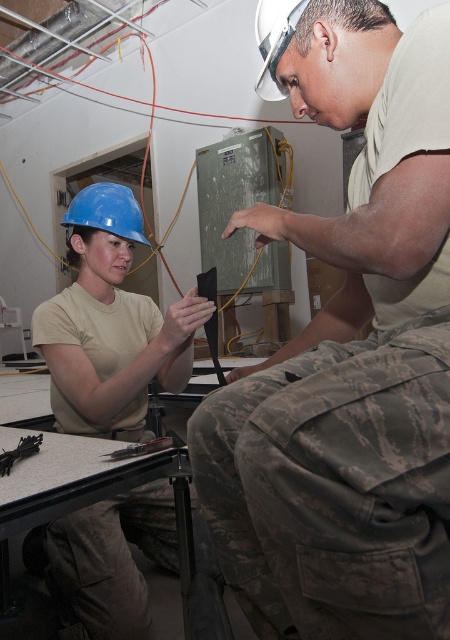
Question: Which is nearer to the metallic silver screwdriver at center?

Choices:
 (A) camouflage fabric pants at lower center
 (B) metallic silver tool at lower left
 (C) blue matte helmet at upper left

Answer: (B)

Question: Does camouflage fabric pants at lower center have a lesser width compared to blue matte helmet at upper left?

Choices:
 (A) yes
 (B) no

Answer: (B)

Question: Is camouflage fabric pants at lower center below blue matte helmet at upper left?

Choices:
 (A) yes
 (B) no

Answer: (A)

Question: Based on their relative distances, which object is nearer to the camouflage fabric pants at lower center?

Choices:
 (A) blue matte helmet at upper left
 (B) metallic silver tool at lower left
 (C) metallic silver screwdriver at center

Answer: (C)

Question: Is camouflage fabric pants at lower center bigger than metallic silver screwdriver at center?

Choices:
 (A) yes
 (B) no

Answer: (A)

Question: Which of the following is the farthest from the observer?

Choices:
 (A) metallic silver tool at lower left
 (B) matte blue hard hat at left
 (C) metallic silver screwdriver at center

Answer: (B)